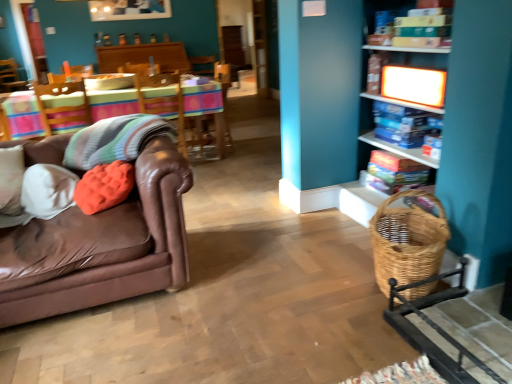
Question: Is knitted wool blanket at left taller or shorter than wooden table at center?

Choices:
 (A) short
 (B) tall

Answer: (A)

Question: Which is correct: knitted wool blanket at left is inside wooden table at center, or outside of it?

Choices:
 (A) inside
 (B) outside

Answer: (B)

Question: Based on their relative distances, which object is farther from the multicolored fabric swivel chair at left, the 2th swivel chair when ordered from right to left?

Choices:
 (A) brown leather couch at left
 (B) white glossy shelf at upper right, which is the 2th shelf in top-to-bottom order
 (C) wooden bookshelf at upper right, which is counted as the 3th shelf, starting from the bottom
 (D) woven brown basket at lower right
 (E) woven wicker rocking chair at lower right

Answer: (E)

Question: Based on their relative distances, which object is farther from the wooden swivel chair at center, the 2th swivel chair from the left?

Choices:
 (A) brown leather couch at left
 (B) wooden shelf at right, positioned as the 1th shelf in bottom-to-top order
 (C) wooden bookshelf at upper right, which is counted as the 3th shelf, starting from the bottom
 (D) woven wicker rocking chair at lower right
 (E) orange fuzzy pillow at left

Answer: (D)